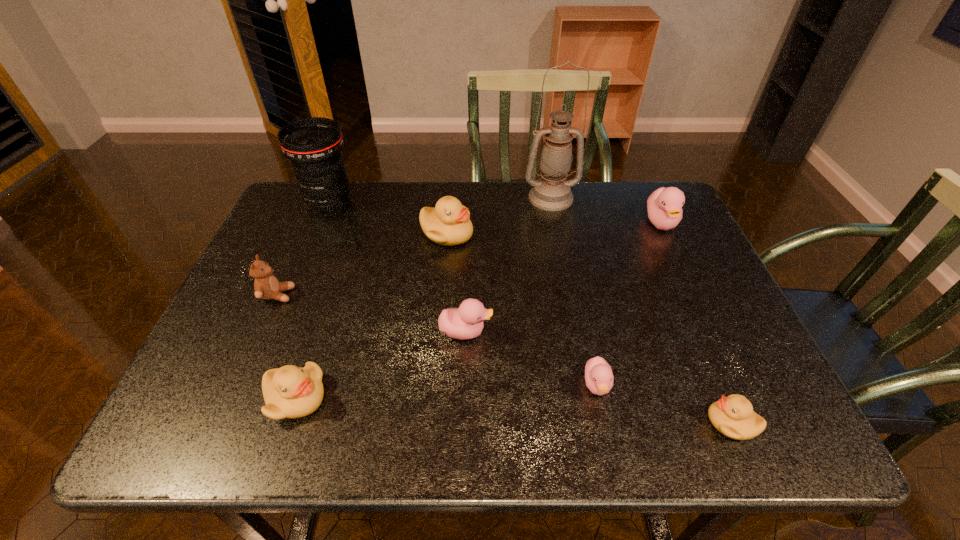
Locate an element on the screen. The image size is (960, 540). the second smallest pink duckling is located at coordinates (466, 322).

I want to click on the leftmost pink duckling, so click(466, 322).

I want to click on the leftmost duckling, so click(290, 392).

Find the location of a particular element. the leftmost yellow duckling is located at coordinates (290, 392).

You are a GUI agent. You are given a task and a screenshot of the screen. Output one action in this format:
    pyautogui.click(x=<x>, y=<y>)
    Task: Click on the second pink duckling from right to left
    This screenshot has height=540, width=960.
    Given the screenshot: What is the action you would take?
    599,378

You are a GUI agent. You are given a task and a screenshot of the screen. Output one action in this format:
    pyautogui.click(x=<x>, y=<y>)
    Task: Click on the third duckling from right to left
    
    Given the screenshot: What is the action you would take?
    pyautogui.click(x=599, y=378)

Find the location of `the rightmost yellow duckling`. the rightmost yellow duckling is located at coordinates (733, 416).

I want to click on vacant space located 0.200m on the right of the gray oil lamp, so click(643, 198).

The width and height of the screenshot is (960, 540). I want to click on blank space located on the right of the eighth shortest object, so click(x=431, y=201).

At what (x,y) coordinates should I click in order to perform the action: click on free location located on the front-facing side of the rightmost pink duckling. Please return your answer as a coordinate pair (x, y). This screenshot has height=540, width=960. Looking at the image, I should click on (683, 268).